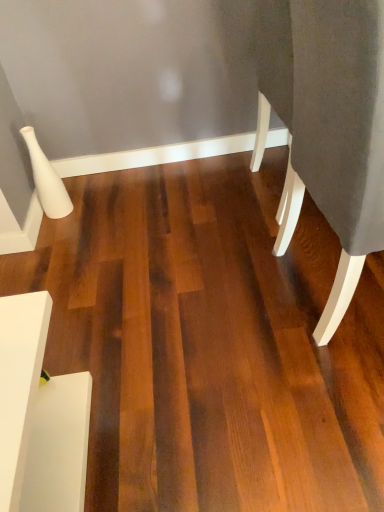
Locate an element on the screen. This screenshot has height=512, width=384. vacant area on the back side of white matte side table at lower left, the second furniture positioned from the top is located at coordinates (98, 338).